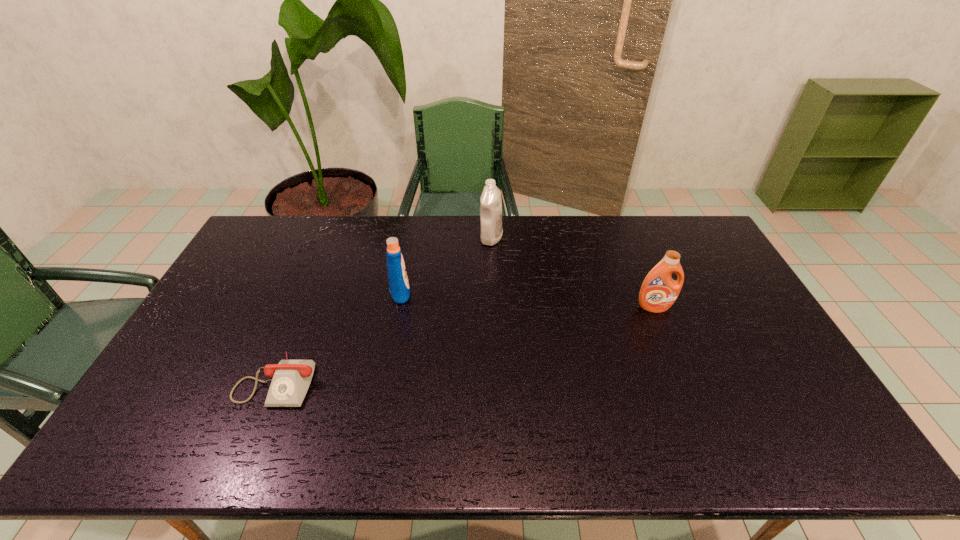
This screenshot has width=960, height=540. What are the coordinates of `vacant region between the second detergent from right to left and the leftmost object` in the screenshot? It's located at (384, 309).

You are a GUI agent. You are given a task and a screenshot of the screen. Output one action in this format:
    pyautogui.click(x=<x>, y=<y>)
    Task: Click on the free area in between the rightmost object and the nearest object
    This screenshot has height=540, width=960.
    Given the screenshot: What is the action you would take?
    pyautogui.click(x=466, y=343)

This screenshot has height=540, width=960. I want to click on vacant point located between the rightmost object and the second detergent from right to left, so click(x=573, y=273).

At what (x,y) coordinates should I click in order to perform the action: click on empty location between the rightmost object and the third object from right to left. Please return your answer as a coordinate pair (x, y). This screenshot has width=960, height=540. Looking at the image, I should click on (527, 299).

At what (x,y) coordinates should I click in order to perform the action: click on vacant space that's between the rightmost detergent and the shortest object. Please return your answer as a coordinate pair (x, y). Looking at the image, I should click on (466, 343).

I want to click on the third closest object relative to the leftmost object, so tap(659, 291).

Image resolution: width=960 pixels, height=540 pixels. Find the location of `object that is the third nearest to the rightmost object`. object that is the third nearest to the rightmost object is located at coordinates (291, 378).

Select which detergent is the closest to the leftmost detergent. Please provide its 2D coordinates. Your answer should be formatted as a tuple, i.e. [(x, y)], where the tuple contains the x and y coordinates of a point satisfying the conditions above.

[(491, 230)]

Locate which detergent ranks third in proximity to the leftmost object. Please provide its 2D coordinates. Your answer should be formatted as a tuple, i.e. [(x, y)], where the tuple contains the x and y coordinates of a point satisfying the conditions above.

[(659, 291)]

Find the location of a particular element. The width and height of the screenshot is (960, 540). vacant space that satisfies the following two spatial constraints: 1. on the front side of the farthest object; 2. on the label of the leftmost detergent is located at coordinates (493, 291).